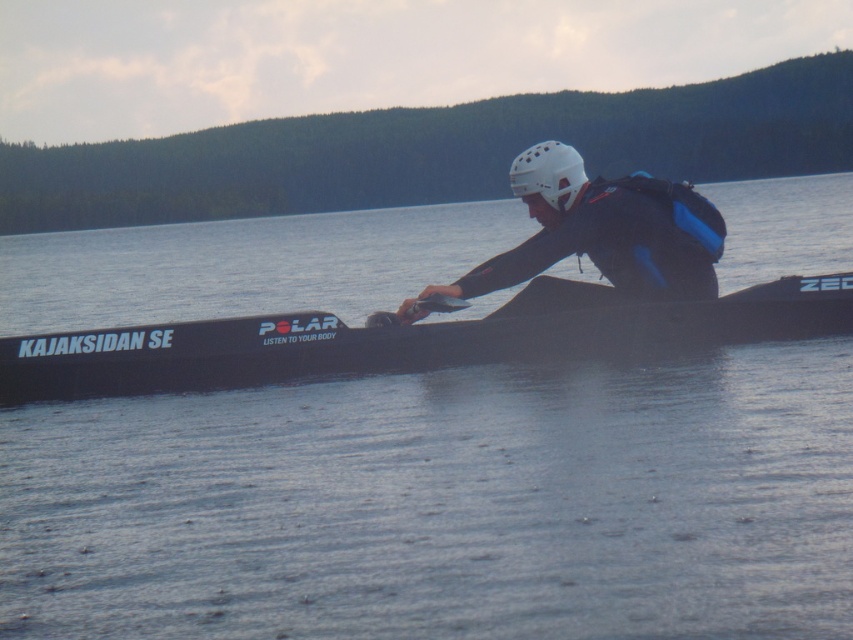
Question: Which object is positioned closest to the black matte kayak at center?

Choices:
 (A) black matte wetsuit at center
 (B) transparent water at center
 (C) white matte helmet at center

Answer: (A)

Question: Does black matte kayak at center appear under black matte wetsuit at center?

Choices:
 (A) no
 (B) yes

Answer: (B)

Question: Does transparent water at center appear under black matte kayak at center?

Choices:
 (A) no
 (B) yes

Answer: (A)

Question: Which of the following is the closest to the observer?

Choices:
 (A) (527, 536)
 (B) (540, 156)
 (C) (642, 321)
 (D) (666, 212)

Answer: (A)

Question: Which point is closer to the camera?

Choices:
 (A) black matte kayak at center
 (B) white matte helmet at center

Answer: (A)

Question: Is transparent water at center below black matte wetsuit at center?

Choices:
 (A) yes
 (B) no

Answer: (B)